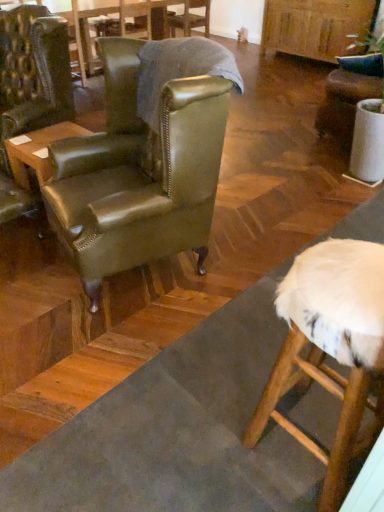
Find the location of a particular element. white fur-covered stool at lower right is located at coordinates (330, 348).

In order to face leather green wingback chair at left, acting as the 2th chair starting from the front, should I rotate leftwards or rightwards?

To align with it, rotate left about 22.517°.

In the scene shown: Measure the distance between point [108,84] and camera.

The depth of point [108,84] is 2.16 meters.

What do you see at coordinates (139, 172) in the screenshot? I see `green leather wingback chair at center, arranged as the 4th chair when viewed from the back` at bounding box center [139, 172].

What is the approximate height of wooden table at left, marked as the first table in a bottom-to-top arrangement?

19.37 inches.

What do you see at coordinates (189, 18) in the screenshot? The image size is (384, 512). I see `leather wingback chair at upper center, acting as the 2th chair starting from the right` at bounding box center [189, 18].

Where is `white fur-covered stool at lower right`? The width and height of the screenshot is (384, 512). white fur-covered stool at lower right is located at coordinates (330, 348).

Which object is further away from the camera taking this photo, white fur-covered stool at lower right or green leather table at upper left, the 2th table when ordered from bottom to top?

green leather table at upper left, the 2th table when ordered from bottom to top.

Is white fur-covered stool at lower right in contact with green leather table at upper left, the 2th table when ordered from bottom to top?

white fur-covered stool at lower right and green leather table at upper left, the 2th table when ordered from bottom to top, are clearly separated.

Which of these two, white fur-covered stool at lower right or green leather table at upper left, the 1th table when ordered from back to front, is bigger?

green leather table at upper left, the 1th table when ordered from back to front.

Between white fur-covered stool at lower right and green leather table at upper left, the 1th table when ordered from back to front, which one has less height?

green leather table at upper left, the 1th table when ordered from back to front, is shorter.

Are leather wingback chair at center, marked as the 3th chair in a front-to-back arrangement, and leather green wingback chair at left, which appears as the 1th chair when viewed from the left, located far from each other?

Yes.

From the image's perspective, between leather wingback chair at center, which is the fourth chair from left to right, and leather green wingback chair at left, the 3th chair when ordered from back to front, which one is located above?

leather wingback chair at center, which is the fourth chair from left to right.

Is point (329, 108) positioned behind point (24, 10)?

Yes, point (329, 108) is farther from viewer.

From a real-world perspective, is leather wingback chair at center, which is the fourth chair from left to right, above or below leather green wingback chair at left, which appears as the 1th chair when viewed from the left?

Clearly, from a real-world perspective, leather wingback chair at center, which is the fourth chair from left to right, is below leather green wingback chair at left, which appears as the 1th chair when viewed from the left.

From the image's perspective, is green leather wingback chair at center, the 1th chair from the front, above wooden table at left, acting as the 2th table starting from the back?

Actually, green leather wingback chair at center, the 1th chair from the front, appears below wooden table at left, acting as the 2th table starting from the back, in the image.

In the scene shown: Between green leather wingback chair at center, acting as the second chair starting from the left, and wooden table at left, acting as the 2th table starting from the back, which one has smaller width?

Thinner between the two is wooden table at left, acting as the 2th table starting from the back.

Is there a large distance between green leather wingback chair at center, acting as the second chair starting from the left, and wooden table at left, positioned as the second table in top-to-bottom order?

No, there isn't a large distance between green leather wingback chair at center, acting as the second chair starting from the left, and wooden table at left, positioned as the second table in top-to-bottom order.

From the picture: From a real-world perspective, is green leather wingback chair at center, acting as the second chair starting from the left, physically below wooden table at left, marked as the first table in a bottom-to-top arrangement?

Incorrect, from a real-world perspective, green leather wingback chair at center, acting as the second chair starting from the left, is higher than wooden table at left, marked as the first table in a bottom-to-top arrangement.

From the wooden table at left, which is the first table from front to back, count 1st chair to the right and point to it. Please provide its 2D coordinates.

[(139, 172)]

From a real-world perspective, is wooden table at left, positioned as the second table in top-to-bottom order, positioned above or below green leather wingback chair at center, the third chair when ordered from right to left?

wooden table at left, positioned as the second table in top-to-bottom order, is situated lower than green leather wingback chair at center, the third chair when ordered from right to left, in the real world.

Is wooden table at left, marked as the first table in a bottom-to-top arrangement, behind green leather wingback chair at center, the third chair when ordered from right to left?

Yes, wooden table at left, marked as the first table in a bottom-to-top arrangement, is further from the viewer.

Is point (26, 151) positioned behind point (208, 97)?

Yes, point (26, 151) is behind point (208, 97).

Is leather green wingback chair at left, which appears as the 1th chair when viewed from the left, located within leather wingback chair at upper center, marked as the 1th chair in a back-to-front arrangement?

No, leather green wingback chair at left, which appears as the 1th chair when viewed from the left, is not a part of leather wingback chair at upper center, marked as the 1th chair in a back-to-front arrangement.

Between leather wingback chair at upper center, which is counted as the third chair, starting from the left, and leather green wingback chair at left, the 3th chair when ordered from back to front, which one has larger width?

Wider between the two is leather green wingback chair at left, the 3th chair when ordered from back to front.

Starting from the leather green wingback chair at left, the 3th chair when ordered from back to front, which chair is the 2nd one to the right? Please provide its 2D coordinates.

[(189, 18)]

From the image's perspective, would you say leather wingback chair at upper center, marked as the 1th chair in a back-to-front arrangement, is positioned over leather green wingback chair at left, the 3th chair when ordered from back to front?

Correct, leather wingback chair at upper center, marked as the 1th chair in a back-to-front arrangement, appears higher than leather green wingback chair at left, the 3th chair when ordered from back to front, in the image.

Considering the relative positions of green leather table at upper left, the 1th table when ordered from back to front, and leather wingback chair at center, the 1th chair viewed from the right, in the image provided, is green leather table at upper left, the 1th table when ordered from back to front, behind leather wingback chair at center, the 1th chair viewed from the right,?

Yes, green leather table at upper left, the 1th table when ordered from back to front, is further from the camera.

From a real-world perspective, is green leather table at upper left, which appears as the 2th table when viewed from the front, below leather wingback chair at center, which is the fourth chair from left to right?

Yes, from a real-world perspective, green leather table at upper left, which appears as the 2th table when viewed from the front, is under leather wingback chair at center, which is the fourth chair from left to right.

Can you tell me how much green leather table at upper left, which appears as the 2th table when viewed from the front, and leather wingback chair at center, the 1th chair viewed from the right, differ in facing direction?

The facing directions of green leather table at upper left, which appears as the 2th table when viewed from the front, and leather wingback chair at center, the 1th chair viewed from the right, are 180 degrees apart.

Is point (86, 64) positioned in front of point (332, 129)?

No, it is not.

Is point (187, 206) positioned before point (35, 63)?

That is True.

From a real-world perspective, is green leather wingback chair at center, arranged as the 4th chair when viewed from the back, physically below leather green wingback chair at left, the 3th chair when ordered from back to front?

No, from a real-world perspective, green leather wingback chair at center, arranged as the 4th chair when viewed from the back, is not below leather green wingback chair at left, the 3th chair when ordered from back to front.

Find the location of a particular element. This screenshot has width=384, height=512. chair below the leather green wingback chair at left, the fourth chair when ordered from right to left (from the image's perspective) is located at coordinates (139, 172).

You are a GUI agent. You are given a task and a screenshot of the screen. Output one action in this format:
    pyautogui.click(x=<x>, y=<y>)
    Task: Click on the bar stool below the green leather table at upper left, the 1th table positioned from the top (from a real-world perspective)
    
    Given the screenshot: What is the action you would take?
    pyautogui.click(x=330, y=348)

Identify the location of chair that is the 1st one when counting backward from the leather green wingback chair at left, the 3th chair when ordered from back to front. This screenshot has width=384, height=512. (346, 99).

Estimate the real-world distances between objects in this image. Which object is closer to leather wingback chair at center, the 1th chair viewed from the right, leather wingback chair at upper center, which is counted as the third chair, starting from the left, or green leather wingback chair at center, acting as the second chair starting from the left?

green leather wingback chair at center, acting as the second chair starting from the left, is positioned closer to the anchor leather wingback chair at center, the 1th chair viewed from the right.

In the scene shown: When comparing their distances from green leather wingback chair at center, the 1th chair from the front, does wooden table at left, which is the first table from front to back, or white fur-covered stool at lower right seem closer?

wooden table at left, which is the first table from front to back, is positioned closer to the anchor green leather wingback chair at center, the 1th chair from the front.

Consider the image. When comparing their distances from white fur-covered stool at lower right, does green leather wingback chair at center, acting as the second chair starting from the left, or leather green wingback chair at left, which appears as the 1th chair when viewed from the left, seem further?

leather green wingback chair at left, which appears as the 1th chair when viewed from the left.

Which object lies further to the anchor point leather wingback chair at upper center, which is counted as the third chair, starting from the left, green leather table at upper left, which appears as the 2th table when viewed from the front, or wooden table at left, positioned as the second table in top-to-bottom order?

The object further to leather wingback chair at upper center, which is counted as the third chair, starting from the left, is wooden table at left, positioned as the second table in top-to-bottom order.

Considering their positions, is white fur-covered stool at lower right positioned closer to wooden table at left, which is the first table from front to back, than leather wingback chair at upper center, marked as the 1th chair in a back-to-front arrangement?

Among the two, white fur-covered stool at lower right is located nearer to wooden table at left, which is the first table from front to back.

When comparing their distances from wooden table at left, marked as the first table in a bottom-to-top arrangement, does leather wingback chair at center, which is the fourth chair from left to right, or green leather wingback chair at center, the 1th chair from the front, seem closer?

green leather wingback chair at center, the 1th chair from the front, lies closer to wooden table at left, marked as the first table in a bottom-to-top arrangement, than the other object.

From the image, which object appears to be nearer to leather green wingback chair at left, which appears as the 1th chair when viewed from the left, white fur-covered stool at lower right or leather wingback chair at center, marked as the 3th chair in a front-to-back arrangement?

leather wingback chair at center, marked as the 3th chair in a front-to-back arrangement, is closer to leather green wingback chair at left, which appears as the 1th chair when viewed from the left.

Which object lies further to the anchor point leather green wingback chair at left, acting as the 2th chair starting from the front, green leather table at upper left, the 1th table when ordered from back to front, or wooden table at left, acting as the 2th table starting from the back?

green leather table at upper left, the 1th table when ordered from back to front, is positioned further to the anchor leather green wingback chair at left, acting as the 2th chair starting from the front.

This screenshot has width=384, height=512. Find the location of `bar stool between leather green wingback chair at left, the 3th chair when ordered from back to front, and leather wingback chair at center, which is the 2th chair in back-to-front order`. bar stool between leather green wingback chair at left, the 3th chair when ordered from back to front, and leather wingback chair at center, which is the 2th chair in back-to-front order is located at coordinates (330, 348).

Find the location of a particular element. The image size is (384, 512). chair positioned between green leather wingback chair at center, arranged as the 4th chair when viewed from the back, and wooden table at left, positioned as the second table in top-to-bottom order, from near to far is located at coordinates (33, 73).

Find the location of `table positioned between wooden table at left, marked as the first table in a bottom-to-top arrangement, and leather wingback chair at upper center, which is the 4th chair from front to back, from near to far`. table positioned between wooden table at left, marked as the first table in a bottom-to-top arrangement, and leather wingback chair at upper center, which is the 4th chair from front to back, from near to far is located at coordinates (118, 22).

You are a GUI agent. You are given a task and a screenshot of the screen. Output one action in this format:
    pyautogui.click(x=<x>, y=<y>)
    Task: Click on the chair positioned between leather green wingback chair at left, acting as the 2th chair starting from the front, and leather wingback chair at upper center, acting as the 2th chair starting from the right, from near to far
    This screenshot has width=384, height=512.
    Given the screenshot: What is the action you would take?
    pyautogui.click(x=346, y=99)